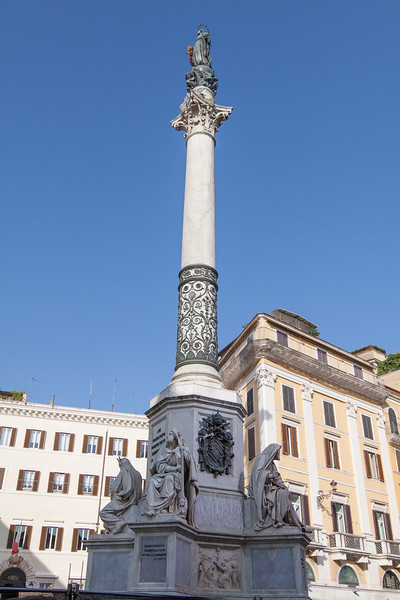
The width and height of the screenshot is (400, 600). Identify the location of flared ends of column top. (226, 113), (196, 102), (177, 121).